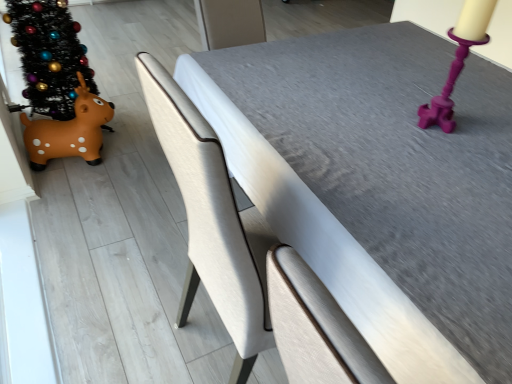
Find the location of a particular element. This screenshot has width=512, height=384. free space behind brown rubber toy at left is located at coordinates (123, 130).